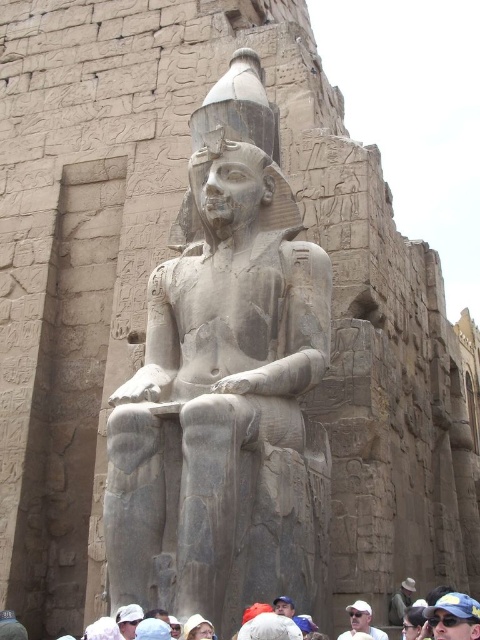
Based on the photo, you are an archaeologist examining the ancient Egyptian statue. You notice a point marked at coordinates (129, 620) on the image. Based on the scene description, what object is located at this point?

The point at coordinates (129, 620) marks the location of the white fabric cap at lower center.

You are an archaeologist examining the ancient Egyptian statue. You notice two white objects in the scene. One is the white clothed heads at lower center and the other is the white matte cap at center. Based on their positions, which object is closer to you?

The white clothed heads at lower center is closer to you because it is positioned in front of the white matte cap at center.

You are an archaeologist examining the statue and notice two white caps. The first is a white fabric cap at lower center and the second is a white matte cap at center. Which of these two caps has a greater width?

The white fabric cap at lower center has a greater width than the white matte cap at center according to the description provided.